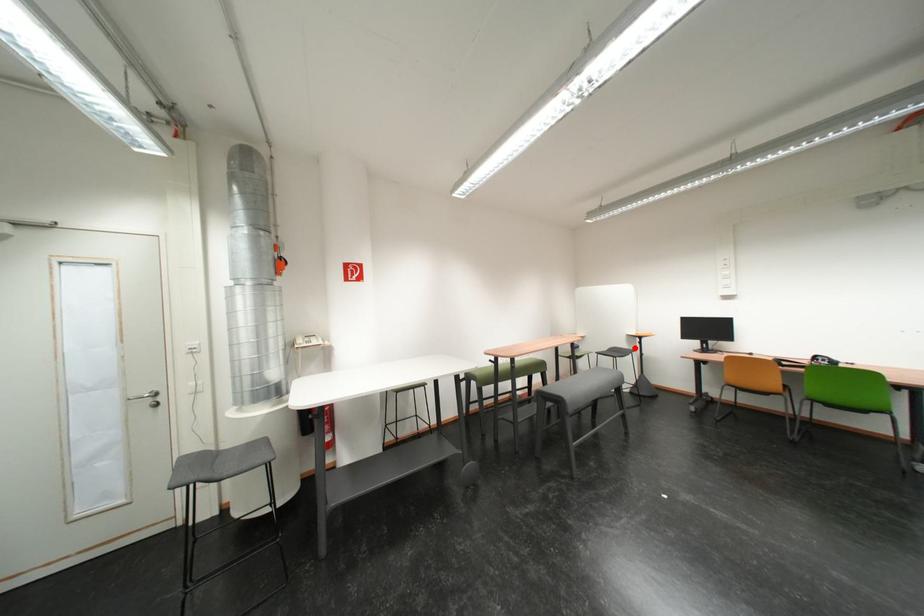
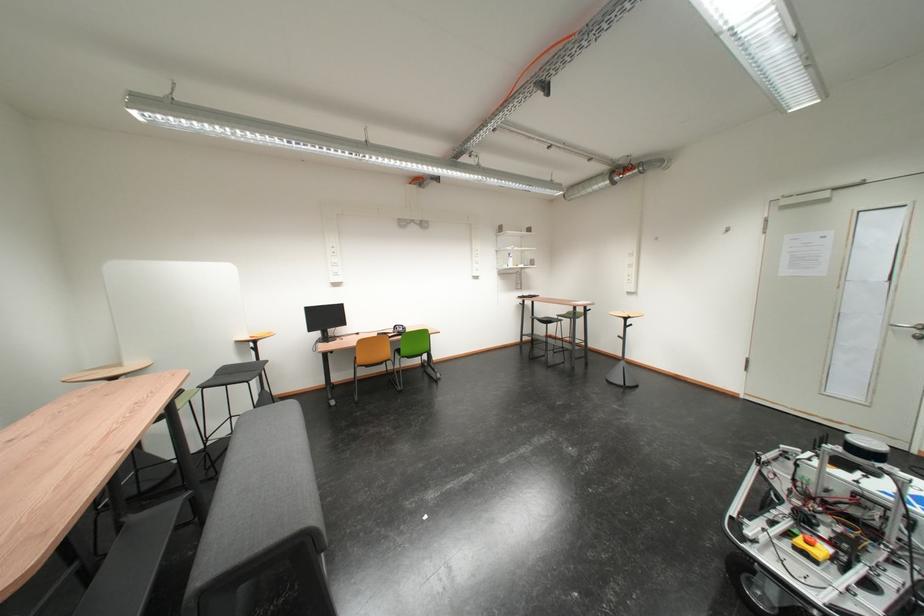
The point at the highlighted location is marked in the first image. Where is the corresponding point in the second image?

(246, 361)